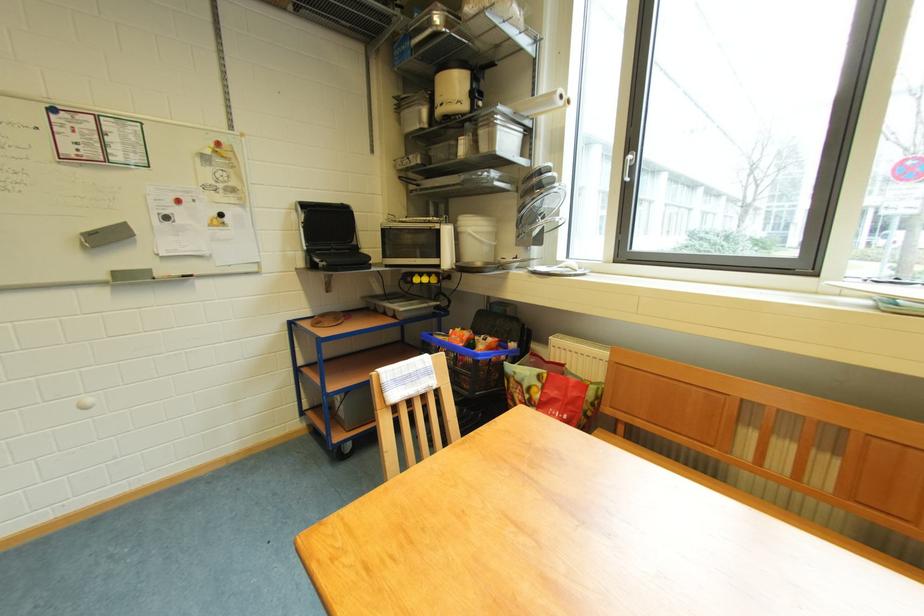
Find where to lift the white plate. Please return your answer as a coordinate pair (x, y).

(560, 270)